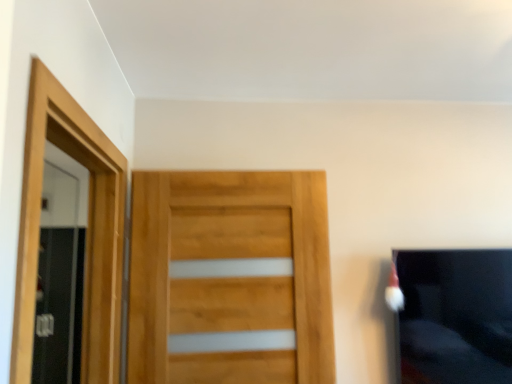
The width and height of the screenshot is (512, 384). What do you see at coordinates (454, 316) in the screenshot?
I see `black fabric couch at right` at bounding box center [454, 316].

Measure the distance between point [303,323] and camera.

The distance of point [303,323] from camera is 5.67 feet.

Locate an element on the screen. Image resolution: width=512 pixels, height=384 pixels. black fabric couch at right is located at coordinates (454, 316).

Is point (60, 159) farther from camera compared to point (208, 329)?

Yes, point (60, 159) is farther from viewer.

Considering the sizes of objects wooden screen door at left, the 2th screen door when ordered from right to left, and natural wood door at center in the image provided, who is wider, wooden screen door at left, the 2th screen door when ordered from right to left, or natural wood door at center?

wooden screen door at left, the 2th screen door when ordered from right to left.

How far apart are wooden screen door at left, the first screen door in the left-to-right sequence, and natural wood door at center?

wooden screen door at left, the first screen door in the left-to-right sequence, is 2.17 meters from natural wood door at center.

From a real-world perspective, who is located higher, wooden screen door at left, which is the 1th screen door in back-to-front order, or natural wood door at center?

natural wood door at center.

Choose the correct answer: Is black fabric couch at right inside natural wood door at center or outside it?

black fabric couch at right cannot be found inside natural wood door at center.

From the image's perspective, which one is positioned higher, black fabric couch at right or natural wood door at center?

natural wood door at center appears higher in the image.

Is black fabric couch at right wider or thinner than natural wood door at center?

black fabric couch at right is wider than natural wood door at center.

Locate an element on the screen. couch below the natural wood door at center (from the image's perspective) is located at coordinates (454, 316).

Considering the sizes of objects wooden screen door at left, which is the 2th screen door in front-to-back order, and natural wood screen door at left, acting as the 1th screen door starting from the right, in the image provided, who is smaller, wooden screen door at left, which is the 2th screen door in front-to-back order, or natural wood screen door at left, acting as the 1th screen door starting from the right,?

With smaller size is natural wood screen door at left, acting as the 1th screen door starting from the right.

The height and width of the screenshot is (384, 512). What are the coordinates of `screen door that is under the natural wood screen door at left, the 2th screen door from the back (from a real-world perspective)` in the screenshot? It's located at (60, 270).

Is wooden screen door at left, the 2th screen door when ordered from right to left, in contact with natural wood screen door at left, the 2th screen door in the left-to-right sequence?

No, wooden screen door at left, the 2th screen door when ordered from right to left, is not making contact with natural wood screen door at left, the 2th screen door in the left-to-right sequence.

From the image's perspective, would you say wooden screen door at left, the 2th screen door when ordered from right to left, is positioned over natural wood screen door at left, the 2th screen door from the back?

Actually, wooden screen door at left, the 2th screen door when ordered from right to left, appears below natural wood screen door at left, the 2th screen door from the back, in the image.

Would you say natural wood door at center is a long distance from natural wood screen door at left, acting as the 1th screen door starting from the right?

They are positioned close to each other.

Would you say natural wood door at center is outside natural wood screen door at left, arranged as the first screen door when viewed from the front?

Yes, natural wood door at center is outside of natural wood screen door at left, arranged as the first screen door when viewed from the front.

From their relative heights in the image, would you say natural wood door at center is taller or shorter than natural wood screen door at left, the 2th screen door from the back?

natural wood door at center is shorter than natural wood screen door at left, the 2th screen door from the back.

Which of these two, natural wood door at center or natural wood screen door at left, arranged as the first screen door when viewed from the front, is thinner?

Thinner between the two is natural wood door at center.

Based on the photo, which is in front, wooden screen door at left, which is the 1th screen door in back-to-front order, or black fabric couch at right?

black fabric couch at right.

Where is `couch on the right of the wooden screen door at left, which is the 2th screen door in front-to-back order`? couch on the right of the wooden screen door at left, which is the 2th screen door in front-to-back order is located at coordinates (454, 316).

Which point is more forward, (x=51, y=363) or (x=499, y=251)?

The point (x=499, y=251) is in front.

From the image's perspective, is wooden screen door at left, which is the 2th screen door in front-to-back order, on top of black fabric couch at right?

No, from the image's perspective, wooden screen door at left, which is the 2th screen door in front-to-back order, is not above black fabric couch at right.

Consider the image. Is black fabric couch at right wider than wooden screen door at left, the first screen door in the left-to-right sequence?

No, black fabric couch at right is not wider than wooden screen door at left, the first screen door in the left-to-right sequence.

Does black fabric couch at right appear on the left side of wooden screen door at left, the 2th screen door when ordered from right to left?

In fact, black fabric couch at right is to the right of wooden screen door at left, the 2th screen door when ordered from right to left.

Is black fabric couch at right taller or shorter than wooden screen door at left, the 2th screen door when ordered from right to left?

black fabric couch at right is shorter than wooden screen door at left, the 2th screen door when ordered from right to left.

From the image's perspective, is black fabric couch at right above or below wooden screen door at left, the 2th screen door when ordered from right to left?

From the image's perspective, black fabric couch at right appears above wooden screen door at left, the 2th screen door when ordered from right to left.

Is point (39, 207) closer to camera compared to point (282, 221)?

Yes, point (39, 207) is in front of point (282, 221).

Looking at their sizes, would you say natural wood screen door at left, arranged as the first screen door when viewed from the front, is wider or thinner than natural wood door at center?

In the image, natural wood screen door at left, arranged as the first screen door when viewed from the front, appears to be wider than natural wood door at center.

From the picture: Is the surface of natural wood screen door at left, arranged as the first screen door when viewed from the front, in direct contact with natural wood door at center?

natural wood screen door at left, arranged as the first screen door when viewed from the front, and natural wood door at center are not in contact.

What are the coordinates of `door that is above the wooden screen door at left, the first screen door in the left-to-right sequence (from a real-world perspective)` in the screenshot? It's located at (229, 278).

This screenshot has height=384, width=512. Find the location of `door on the left of black fabric couch at right`. door on the left of black fabric couch at right is located at coordinates (229, 278).

Which object lies further to the anchor point black fabric couch at right, natural wood door at center or natural wood screen door at left, acting as the 1th screen door starting from the right?

The object further to black fabric couch at right is natural wood screen door at left, acting as the 1th screen door starting from the right.

Estimate the real-world distances between objects in this image. Which object is closer to wooden screen door at left, the first screen door in the left-to-right sequence, black fabric couch at right or natural wood door at center?

natural wood door at center.

Looking at the image, which one is located further to wooden screen door at left, which is the 1th screen door in back-to-front order, natural wood screen door at left, the 2th screen door in the left-to-right sequence, or natural wood door at center?

The object further to wooden screen door at left, which is the 1th screen door in back-to-front order, is natural wood screen door at left, the 2th screen door in the left-to-right sequence.

Estimate the real-world distances between objects in this image. Which object is further from natural wood door at center, black fabric couch at right or wooden screen door at left, which is the 1th screen door in back-to-front order?

wooden screen door at left, which is the 1th screen door in back-to-front order, is further to natural wood door at center.

Considering their positions, is wooden screen door at left, the 2th screen door when ordered from right to left, positioned further to natural wood screen door at left, the 2th screen door from the back, than natural wood door at center?

Among the two, wooden screen door at left, the 2th screen door when ordered from right to left, is located further to natural wood screen door at left, the 2th screen door from the back.

When comparing their distances from natural wood door at center, does natural wood screen door at left, the 2th screen door in the left-to-right sequence, or black fabric couch at right seem closer?

The object closer to natural wood door at center is natural wood screen door at left, the 2th screen door in the left-to-right sequence.

Consider the image. Estimate the real-world distances between objects in this image. Which object is closer to wooden screen door at left, the 2th screen door when ordered from right to left, natural wood door at center or black fabric couch at right?

natural wood door at center is positioned closer to the anchor wooden screen door at left, the 2th screen door when ordered from right to left.

Estimate the real-world distances between objects in this image. Which object is further from natural wood screen door at left, arranged as the first screen door when viewed from the front, black fabric couch at right or wooden screen door at left, the first screen door in the left-to-right sequence?

wooden screen door at left, the first screen door in the left-to-right sequence, lies further to natural wood screen door at left, arranged as the first screen door when viewed from the front, than the other object.

Where is `door situated between natural wood screen door at left, acting as the 1th screen door starting from the right, and black fabric couch at right from left to right`? door situated between natural wood screen door at left, acting as the 1th screen door starting from the right, and black fabric couch at right from left to right is located at coordinates tap(229, 278).

This screenshot has height=384, width=512. What are the coordinates of `door positioned between natural wood screen door at left, the 2th screen door in the left-to-right sequence, and wooden screen door at left, the first screen door in the left-to-right sequence, from near to far` in the screenshot? It's located at (229, 278).

Where is `door between wooden screen door at left, the 2th screen door when ordered from right to left, and black fabric couch at right, in the horizontal direction`? This screenshot has width=512, height=384. door between wooden screen door at left, the 2th screen door when ordered from right to left, and black fabric couch at right, in the horizontal direction is located at coordinates (229, 278).

Locate an element on the screen. screen door between wooden screen door at left, the first screen door in the left-to-right sequence, and black fabric couch at right is located at coordinates (87, 231).